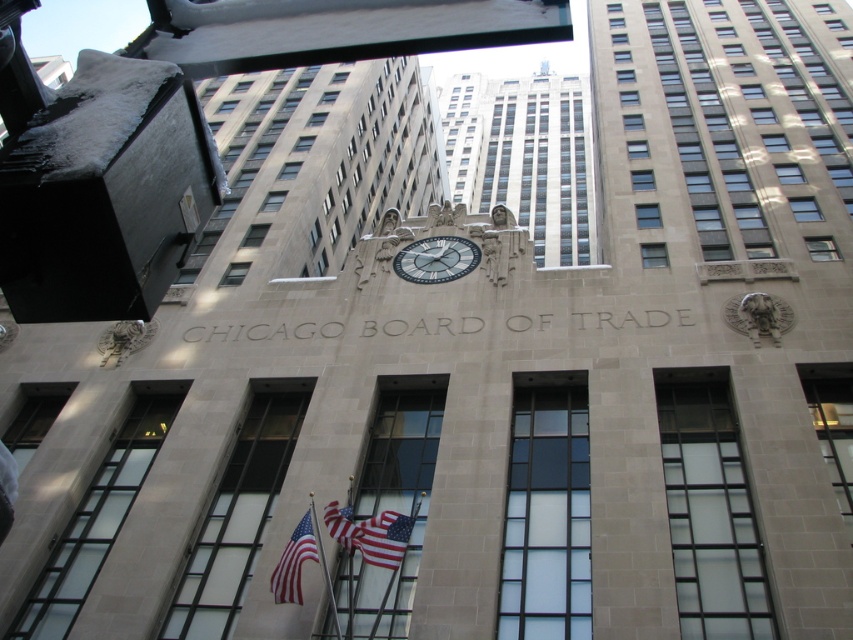
Question: Is american flag at center further to camera compared to white glass clock at center?

Choices:
 (A) yes
 (B) no

Answer: (B)

Question: Among these objects, which one is nearest to the camera?

Choices:
 (A) metallic flagpole at center
 (B) american flag at center

Answer: (B)

Question: Does american flag at center appear on the right side of red fabric flag at center?

Choices:
 (A) yes
 (B) no

Answer: (A)

Question: Can you confirm if american flag at lower center is wider than red fabric flag at center?

Choices:
 (A) yes
 (B) no

Answer: (A)

Question: Which of the following is the closest to the observer?

Choices:
 (A) (343, 528)
 (B) (340, 636)

Answer: (B)

Question: Which object is positioned closest to the american flag at center?

Choices:
 (A) white glass clock at center
 (B) red fabric flag at center
 (C) metallic flagpole at center
 (D) american flag at lower center

Answer: (B)